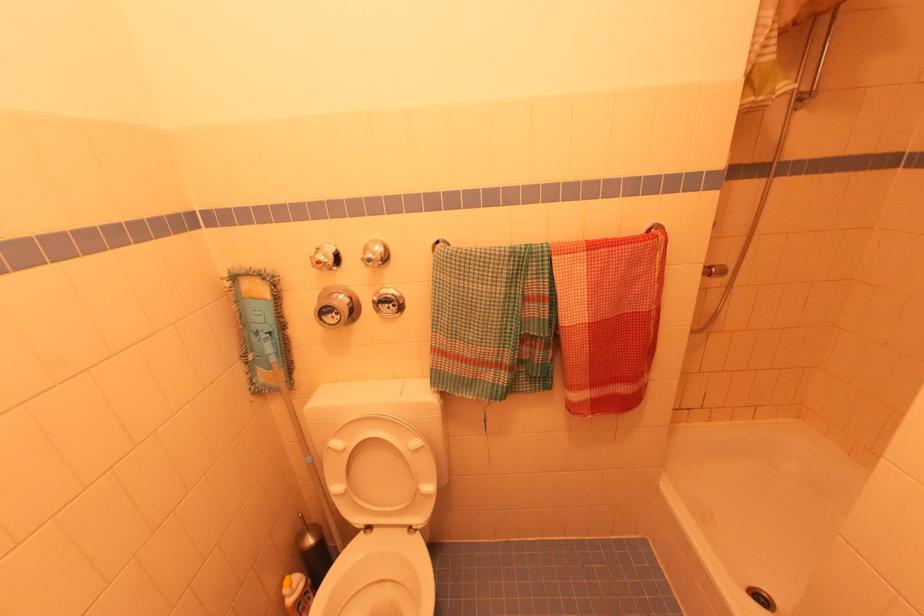
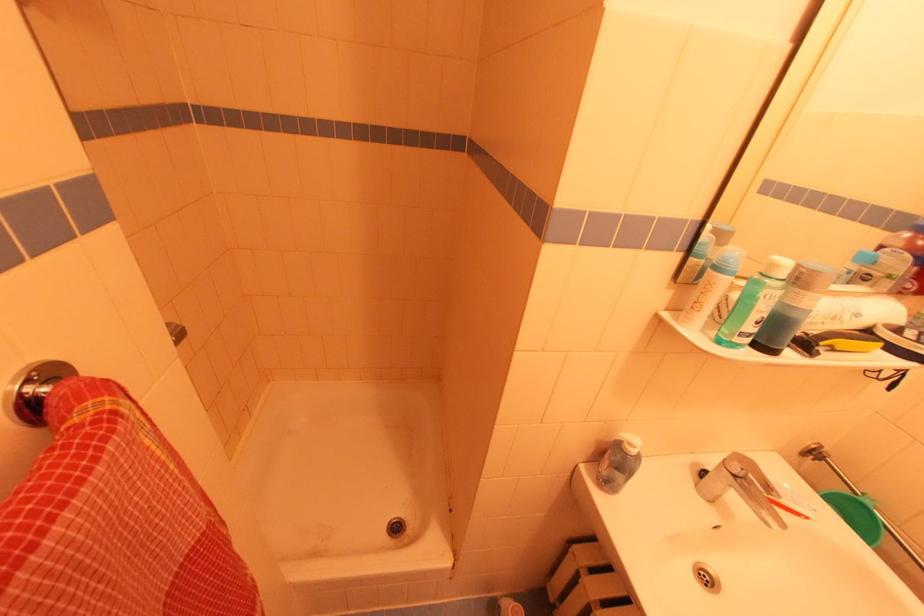
The images are taken continuously from a first-person perspective. In which direction is your viewpoint rotating?

The camera's rotation is toward right-down.